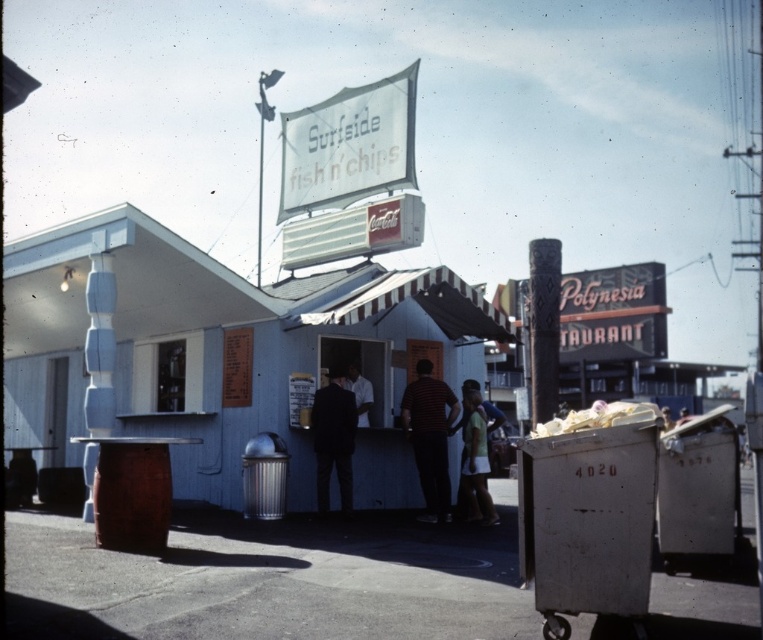
Question: Which of the following is the closest to the observer?

Choices:
 (A) striped shirt at center
 (B) dark blue suit at center
 (C) white matte shirt at center

Answer: (B)

Question: Which point is closer to the camera?

Choices:
 (A) dark blue suit at center
 (B) striped shirt at center
 (C) white matte shirt at center

Answer: (A)

Question: Considering the relative positions of dark blue suit at center and white matte shirt at center in the image provided, where is dark blue suit at center located with respect to white matte shirt at center?

Choices:
 (A) above
 (B) below

Answer: (B)

Question: Is dark blue suit at center behind white matte shirt at center?

Choices:
 (A) no
 (B) yes

Answer: (A)

Question: Considering the real-world distances, which object is farthest from the dark blue suit at center?

Choices:
 (A) white matte shirt at center
 (B) striped shirt at center

Answer: (B)

Question: Is striped shirt at center positioned at the back of dark blue suit at center?

Choices:
 (A) no
 (B) yes

Answer: (B)